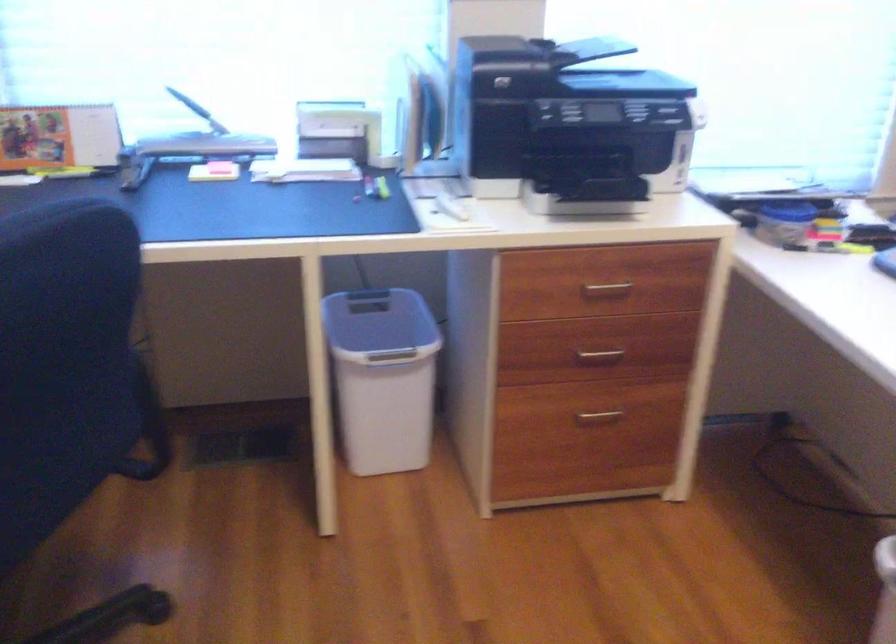
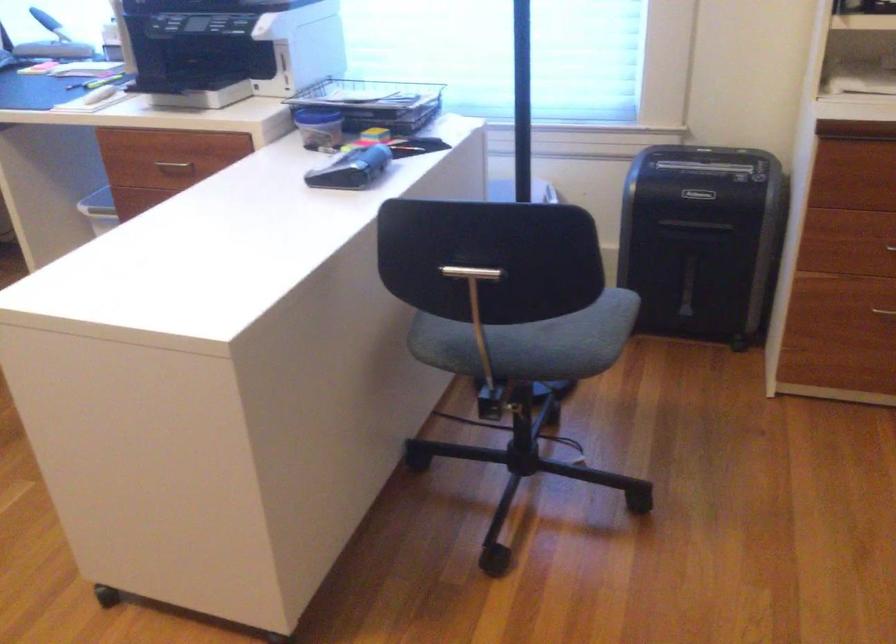
Question: The images are taken continuously from a first-person perspective. In which direction are you moving?

Choices:
 (A) Left
 (B) Right
 (C) Forward
 (D) Backward

Answer: (B)